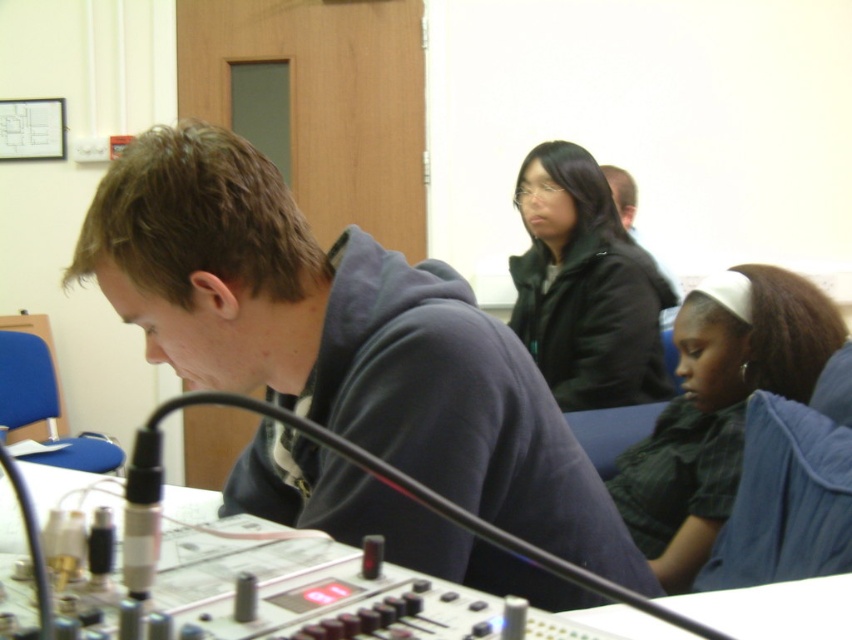
You are standing in the classroom and need to move from point A to point B. Point A is at coordinate point (x=810, y=285) and point B is at coordinate point (x=537, y=349). Which point is closer to you when you first enter the room?

Point A at coordinate point (x=810, y=285) is closer to the viewer than point B at coordinate point (x=537, y=349).

You are organizing a photoshoot and need to place a 1.2 meter wide backdrop. The backdrop must be placed between the dark green fabric shirt at lower right and the matte black jacket at upper center. Will the backdrop fit between them?

The dark green fabric shirt at lower right is wider than the matte black jacket at upper center. However, the question is about fitting a backdrop between them based on their widths. Since the backdrop is 1.2 meters wide and the objects are described in terms of their own widths, not the distance between them, the provided information does not indicate the actual spacing between the two objects. Therefore, it cannot be determined if the backdrop will fit solely based on the given data.

You are standing at the center of the room and want to move to the dark green fabric shirt at lower right. What direction should you move in to reach it?

Since the dark green fabric shirt at lower right is located at point 0.637 on the x and 0.844 on the y, you should move towards the lower right direction to reach it.